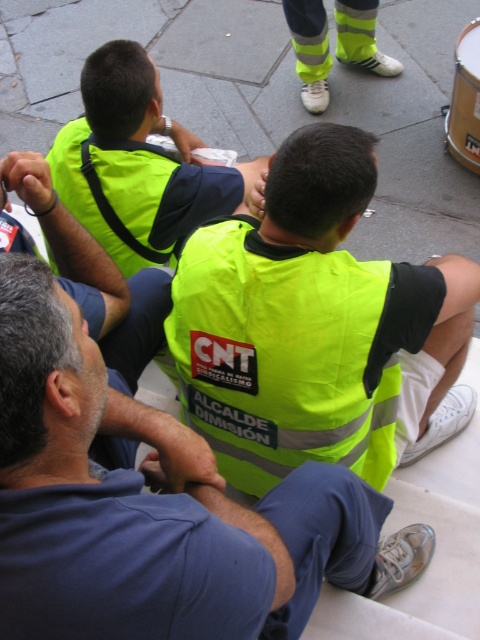
How much distance is there between yellow reflective vest at center and neon yellow vest at upper center?

28.43 inches

Who is shorter, yellow reflective vest at center or neon yellow vest at upper center?

Standing shorter between the two is neon yellow vest at upper center.

Measure the distance between point (x=216, y=371) and camera.

5.68 feet

The width and height of the screenshot is (480, 640). In order to click on yellow reflective vest at center in this screenshot , I will do `click(280, 355)`.

Does high visibility vest at center lie in front of neon yellow vest at upper center?

Yes, it is.

Does high visibility vest at center have a lesser height compared to neon yellow vest at upper center?

In fact, high visibility vest at center may be taller than neon yellow vest at upper center.

Does point (285, 536) lie in front of point (106, 108)?

Yes, point (285, 536) is closer to viewer.

You are a GUI agent. You are given a task and a screenshot of the screen. Output one action in this format:
    pyautogui.click(x=<x>, y=<y>)
    Task: Click on the high visibility vest at center
    The width and height of the screenshot is (480, 640).
    Given the screenshot: What is the action you would take?
    pyautogui.click(x=154, y=508)

Looking at this image, can you confirm if high visibility vest at center is positioned to the right of yellow reflective vest at center?

In fact, high visibility vest at center is to the left of yellow reflective vest at center.

Between point (80, 618) and point (373, 285), which one is positioned in front?

Positioned in front is point (80, 618).

At what (x,y) coordinates should I click in order to perform the action: click on high visibility vest at center. Please return your answer as a coordinate pair (x, y). Looking at the image, I should click on (154, 508).